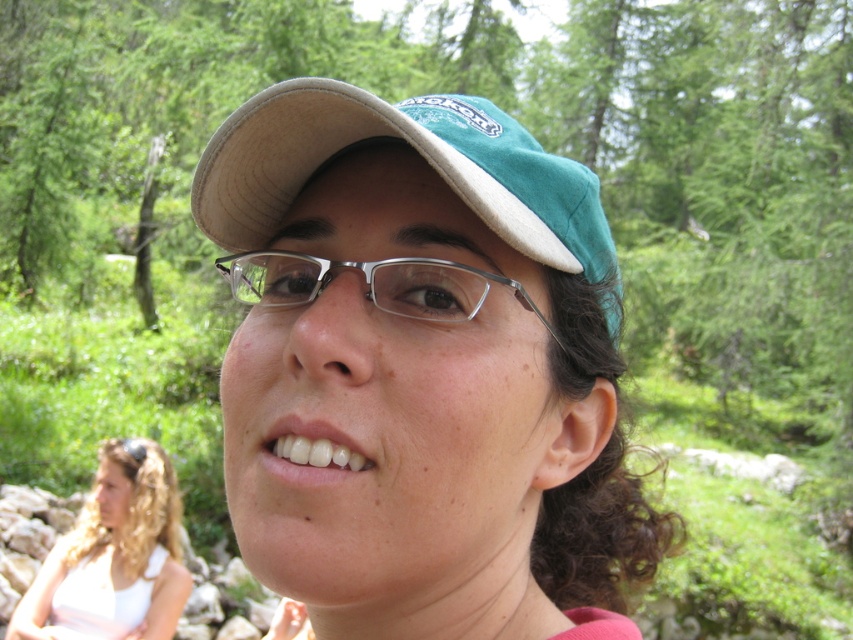
Question: Based on their relative distances, which object is nearer to the green fabric baseball cap at center?

Choices:
 (A) clear plastic glasses at center
 (B) blonde hair at lower left
 (C) green suede cap at center

Answer: (A)

Question: Does blonde hair at lower left appear over clear plastic glasses at center?

Choices:
 (A) yes
 (B) no

Answer: (B)

Question: Can you confirm if green suede cap at center is wider than clear plastic glasses at center?

Choices:
 (A) yes
 (B) no

Answer: (A)

Question: Among these points, which one is nearest to the camera?

Choices:
 (A) coord(206,195)
 (B) coord(345,556)

Answer: (B)

Question: Can you confirm if blonde hair at lower left is smaller than clear plastic glasses at center?

Choices:
 (A) yes
 (B) no

Answer: (B)

Question: Which of the following is the closest to the observer?

Choices:
 (A) blonde hair at lower left
 (B) clear plastic glasses at center

Answer: (B)